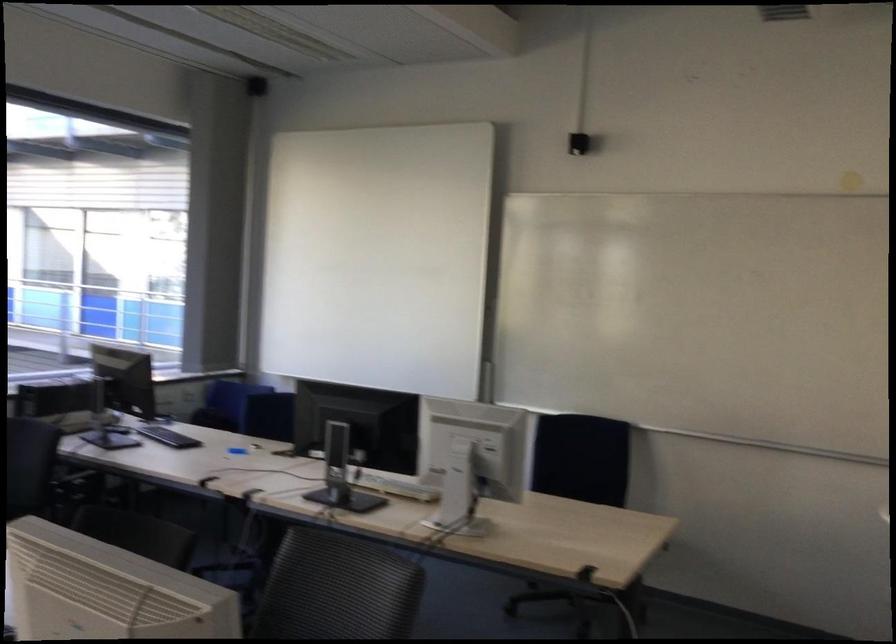
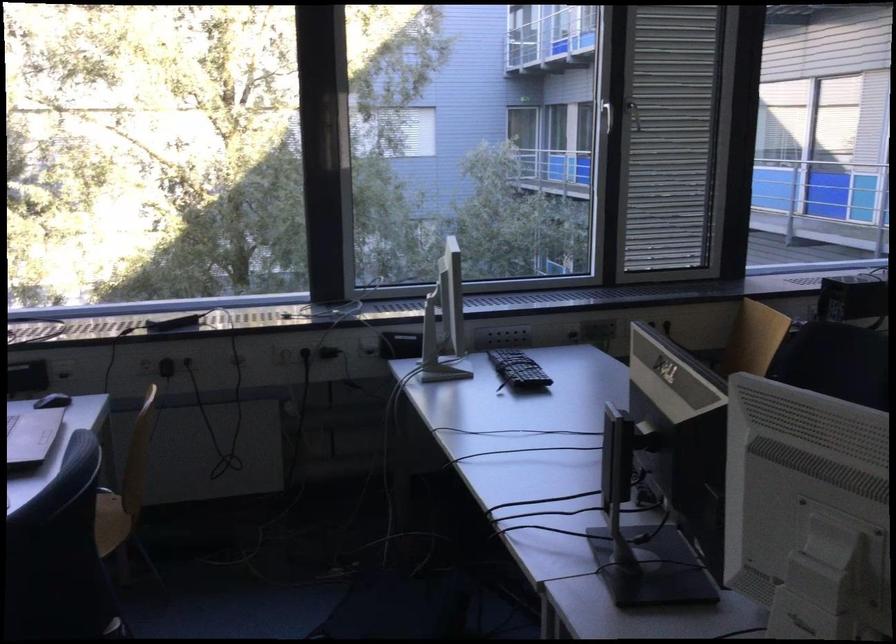
Question: Based on the continuous images, in which direction is the camera rotating? Reply with the corresponding letter.

Choices:
 (A) Left
 (B) Right
 (C) Up
 (D) Down

Answer: (A)